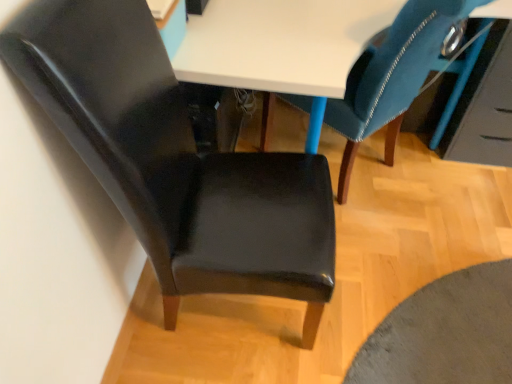
Where is `free point to the right of matte black chair at left, marked as the 2th chair in a right-to-left arrangement`? The height and width of the screenshot is (384, 512). free point to the right of matte black chair at left, marked as the 2th chair in a right-to-left arrangement is located at coordinates (389, 318).